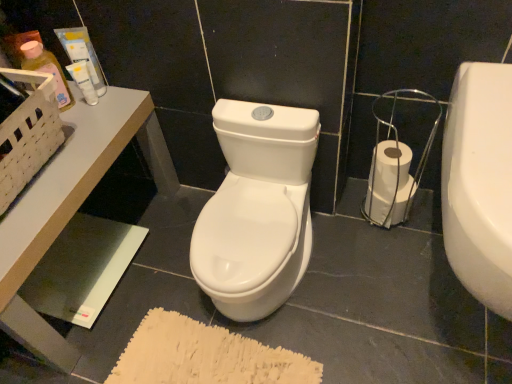
You are a GUI agent. You are given a task and a screenshot of the screen. Output one action in this format:
    pyautogui.click(x=<x>, y=<y>)
    Task: Click on the vacant area that is situated to the right of white matte tube at upper left, arranged as the first toiletry when viewed from the right
    Image resolution: width=512 pixels, height=384 pixels.
    Given the screenshot: What is the action you would take?
    pyautogui.click(x=124, y=103)